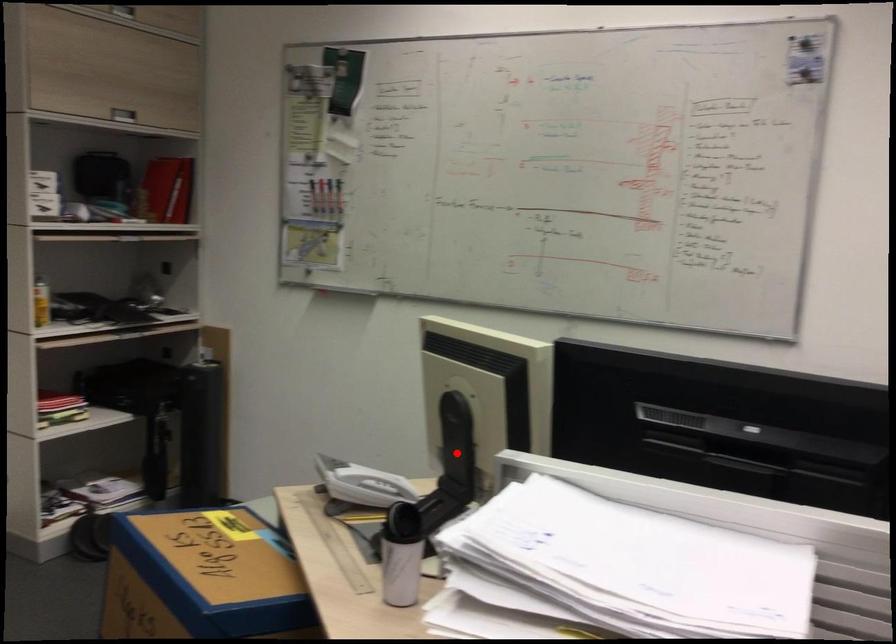
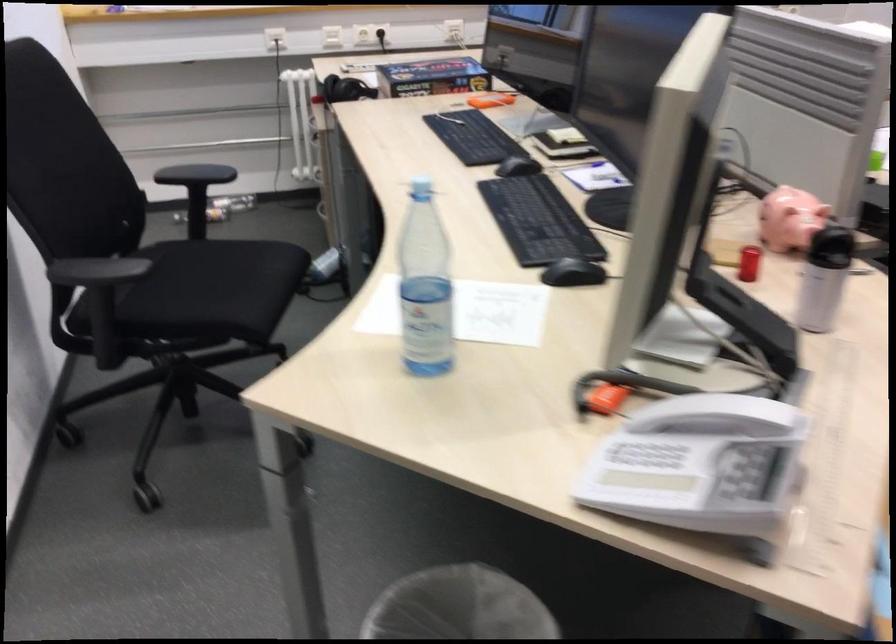
Question: I am providing you with two images of the same scene from different viewpoints. A red point is marked on the first image. Can you still see the location of the red point in image 2?

Choices:
 (A) Yes
 (B) No

Answer: (B)